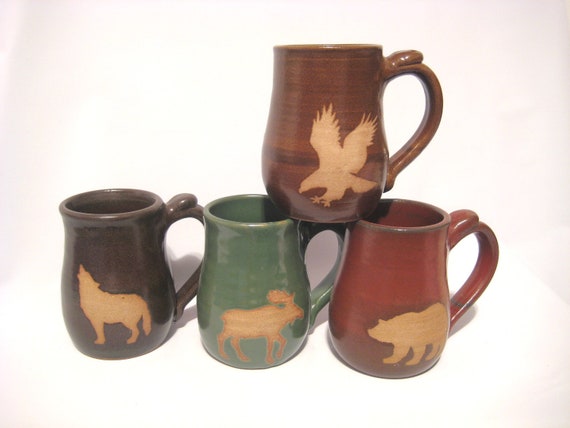
In order to click on handle in this screenshot , I will do `click(414, 140)`.